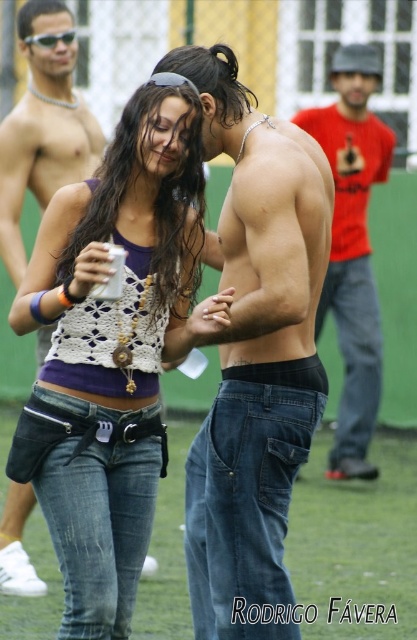
You are a photographer trying to capture a closeup shot of the sunglasses at upper left without including the denim jeans at center in the frame. Is it possible to do so based on their relative heights?

The denim jeans at center has a greater height compared to sunglasses at upper left. Since the jeans are taller, it might block the view of the sunglasses if they are positioned in front. However, without knowing their exact positions, it is uncertain. Please provide more details about their arrangement.

You are taking a photo of two points in the scene. The first point is at coordinates point (98, 605) and the second point is at point (45, 38). Which point will appear larger in your photo?

Point (98, 605) is closer to the camera than point (45, 38), so it will appear larger in the photo.

Looking at this image, you are standing in the park and see a woman wearing high waist blue jeans with a black belt. There is a small point at position (92, 500). Where exactly is this point located on her clothing?

The point at (92, 500) is located on the denim jeans at center.